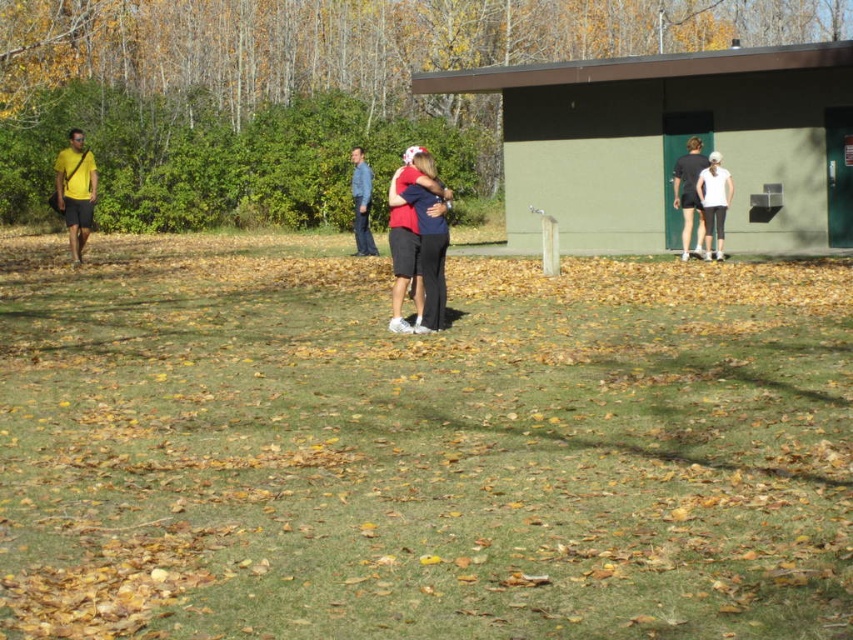
Question: Is matte black shorts at center above yellow matte shirt at left?

Choices:
 (A) yes
 (B) no

Answer: (B)

Question: Is green matte building at center bigger than matte black shorts at center?

Choices:
 (A) yes
 (B) no

Answer: (B)

Question: Which object is positioned closest to the blue denim jeans at center?

Choices:
 (A) yellow matte shirt at left
 (B) dark gray shorts at right

Answer: (A)

Question: Estimate the real-world distances between objects in this image. Which object is farther from the white matte leggings at right?

Choices:
 (A) matte black shorts at center
 (B) yellow matte shirt at left
 (C) dark gray shorts at right
 (D) blue denim jeans at center

Answer: (B)

Question: Is dark gray shorts at right to the left of white matte leggings at right from the viewer's perspective?

Choices:
 (A) no
 (B) yes

Answer: (B)

Question: Among these objects, which one is nearest to the camera?

Choices:
 (A) dark gray shorts at right
 (B) matte black shorts at center
 (C) blue denim jeans at center

Answer: (B)